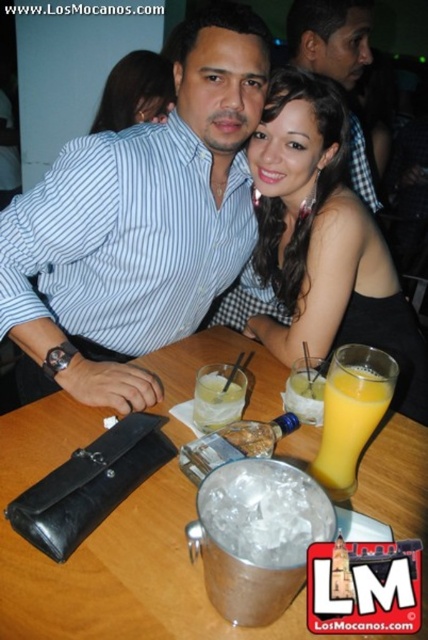
Does matte black shirt at center have a greater width compared to clear glass at table center?

Yes, matte black shirt at center is wider than clear glass at table center.

Is point (302, 52) closer to viewer compared to point (205, 420)?

No, it is behind (205, 420).

Is point (291, 17) positioned in front of point (196, 410)?

No, it is behind (196, 410).

You are a GUI agent. You are given a task and a screenshot of the screen. Output one action in this format:
    pyautogui.click(x=<x>, y=<y>)
    Task: Click on the matte black shirt at center
    This screenshot has height=640, width=428.
    Given the screenshot: What is the action you would take?
    pyautogui.click(x=329, y=36)

Which is more to the right, metallic silver bucket at center or yellow translucent glass at table center?

yellow translucent glass at table center is more to the right.

Find the location of `metallic silver bucket at center`. metallic silver bucket at center is located at coordinates 107,550.

Is striped cotton shirt at center bigger than yellow translucent glass at table center?

Yes.

Measure the distance between striped cotton shirt at center and camera.

The distance of striped cotton shirt at center from camera is 35.89 inches.

What do you see at coordinates (140, 221) in the screenshot?
I see `striped cotton shirt at center` at bounding box center [140, 221].

You are a GUI agent. You are given a task and a screenshot of the screen. Output one action in this format:
    pyautogui.click(x=<x>, y=<y>)
    Task: Click on the striped cotton shirt at center
    This screenshot has width=428, height=640.
    Given the screenshot: What is the action you would take?
    pyautogui.click(x=140, y=221)